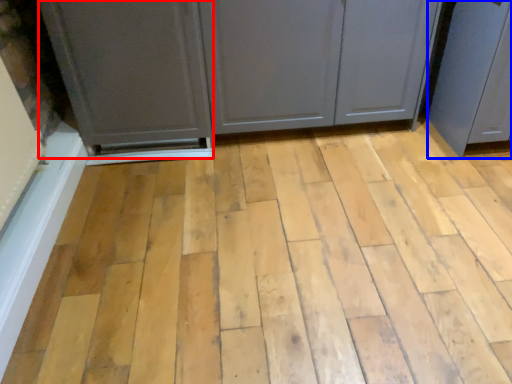
Question: Which of the following is the closest to the observer, screen door (highlighted by a red box) or screen door (highlighted by a blue box)?

Choices:
 (A) screen door
 (B) screen door

Answer: (B)